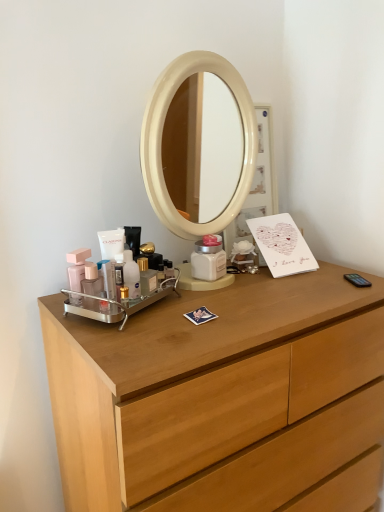
Find the location of a particular element. This screenshot has width=384, height=512. vacant area located to the right-hand side of matte pink plastic at left, marked as the fourth toiletry in a right-to-left arrangement is located at coordinates (162, 311).